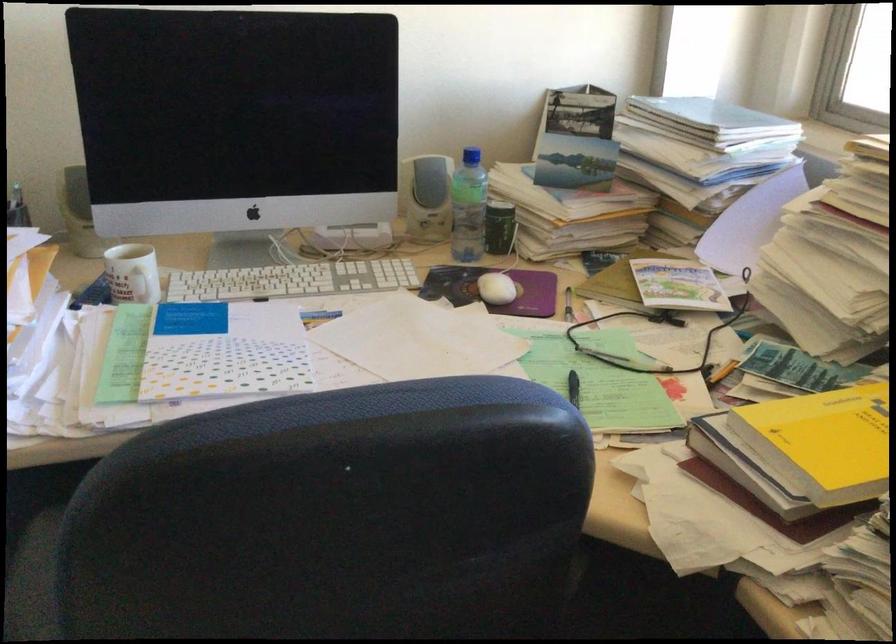
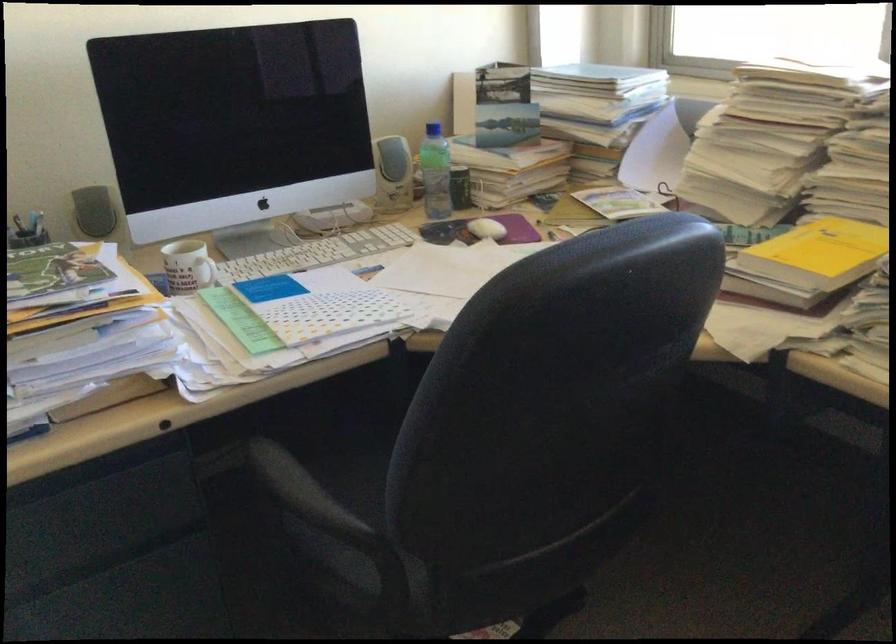
Locate, in the second image, the point that corresponds to point (467, 160) in the first image.

(433, 129)